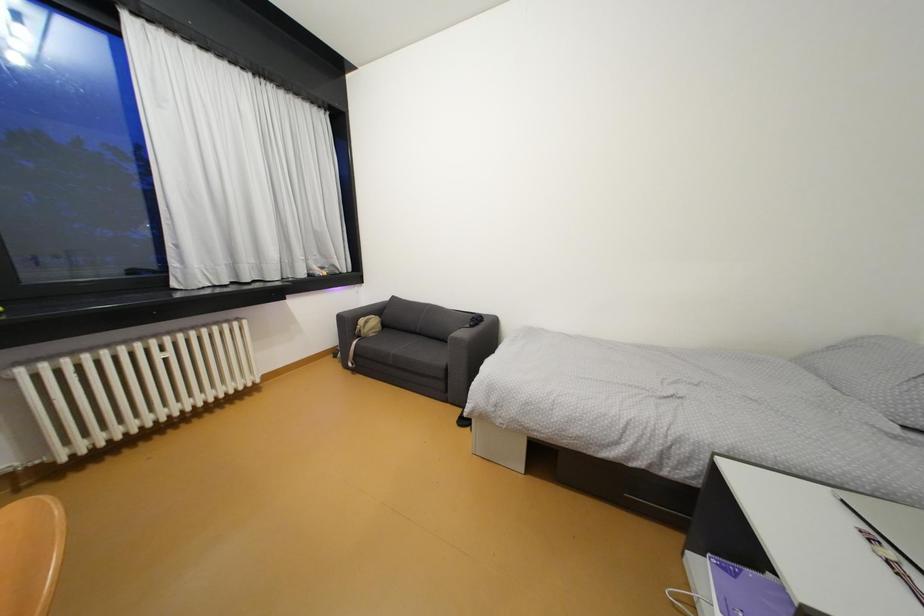
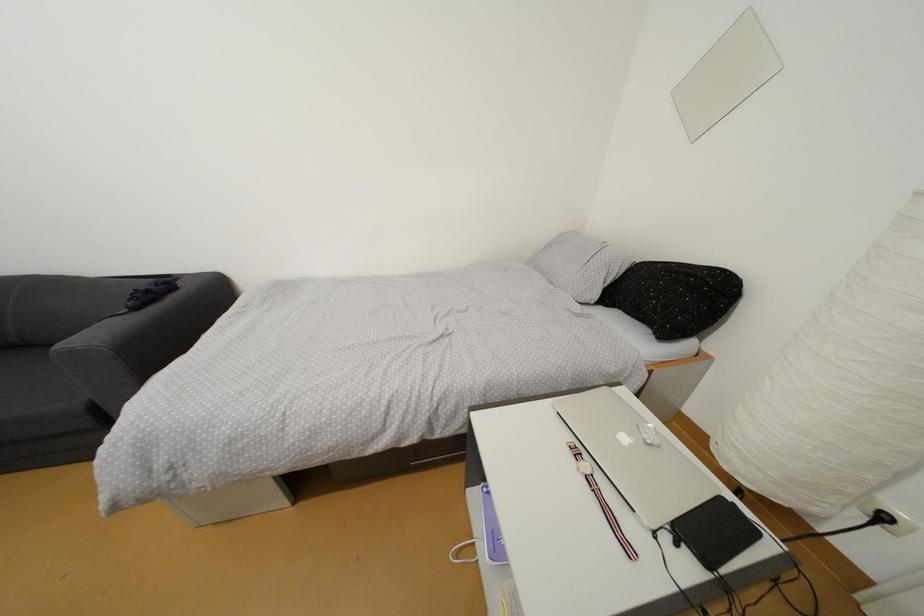
First-person continuous shooting, in which direction is the camera rotating?

The camera's rotation is toward right-down.